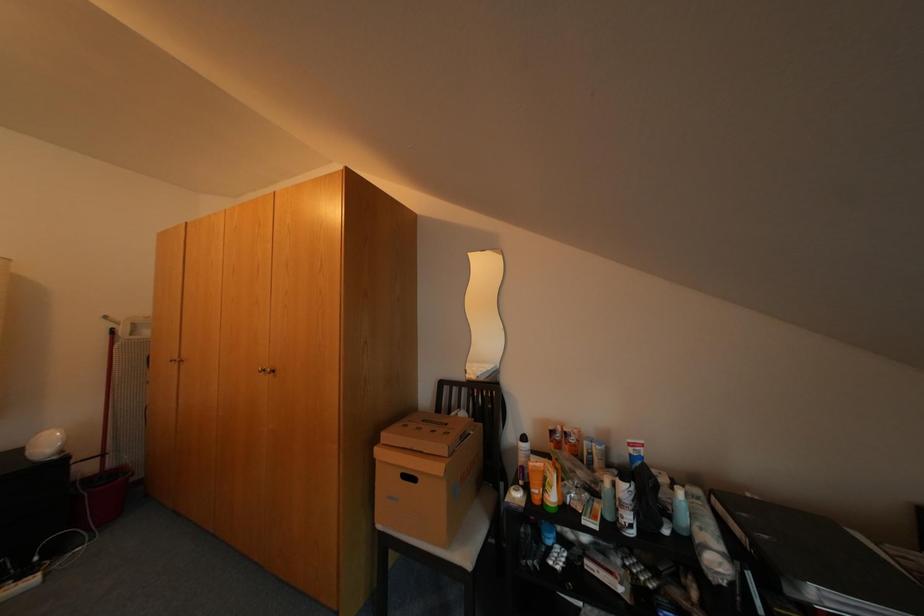
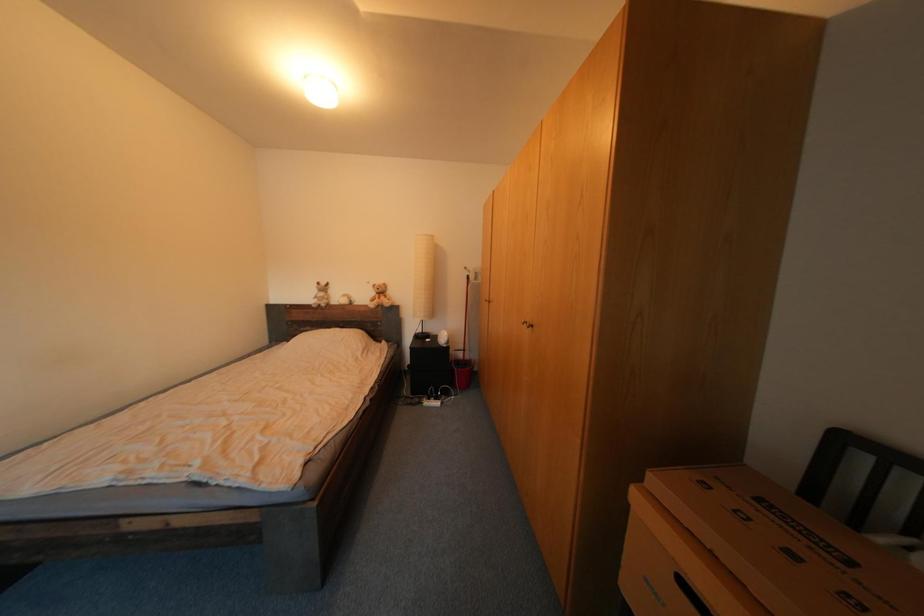
Question: The camera is either moving clockwise (left) or counter-clockwise (right) around the object. The first image is from the beginning of the video and the second image is from the end. Is the camera moving left or right when shooting the video?

Choices:
 (A) Left
 (B) Right

Answer: (B)